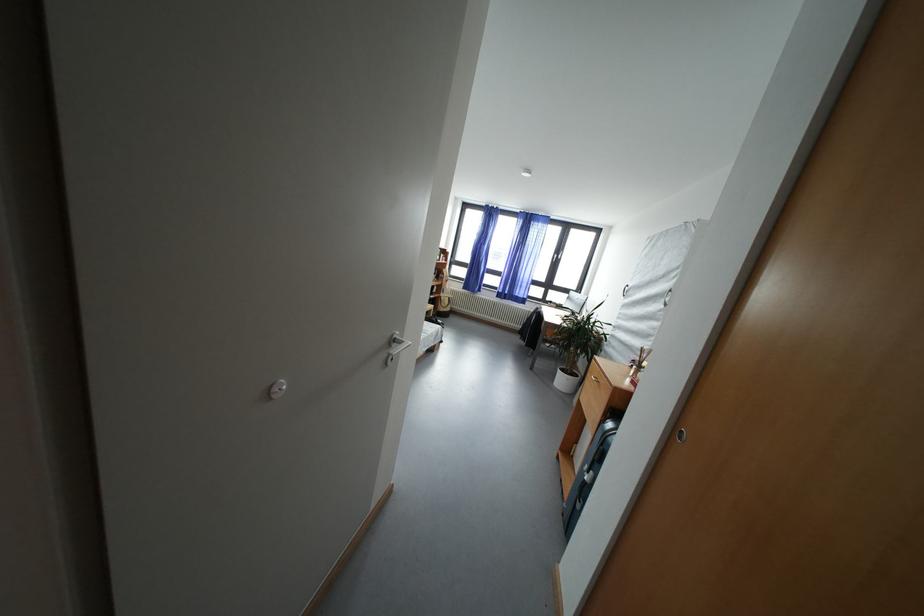
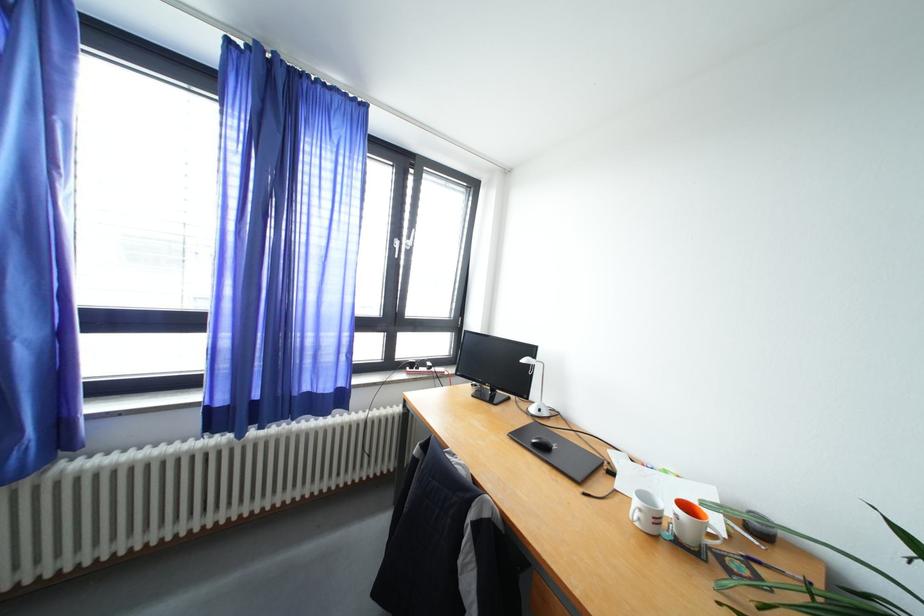
In the second image, find the point that corresponds to point (557, 307) in the first image.

(419, 370)